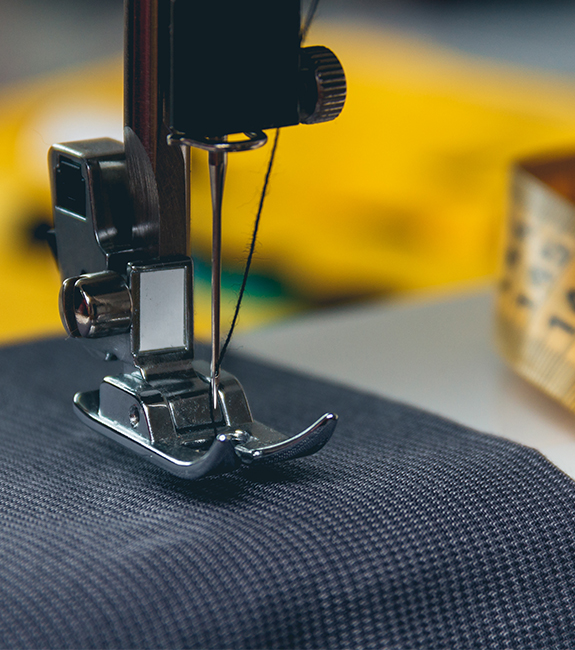
I want to click on sewing machine base, so click(x=457, y=374).